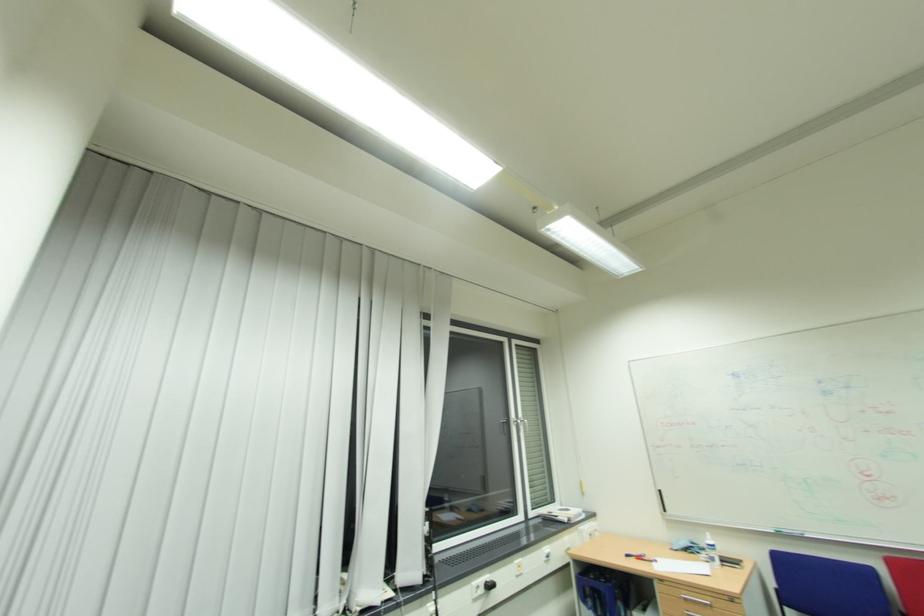
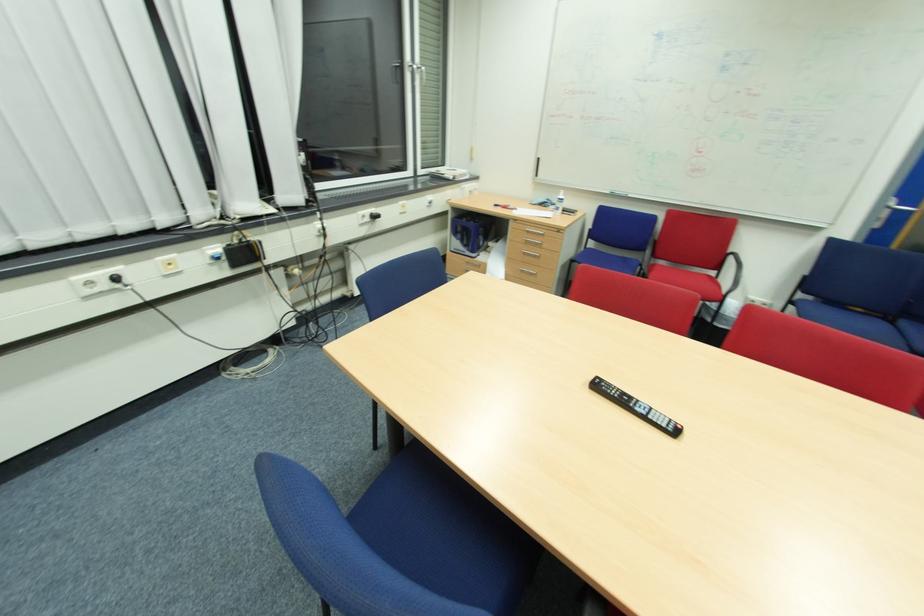
The first image is from the beginning of the video and the second image is from the end. How did the camera likely rotate when shooting the video?

The camera's rotation is toward right-down.